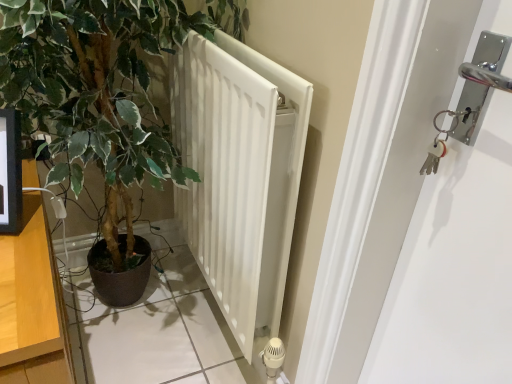
Question: Is green leafy plant at center in front of or behind white matte radiator at center in the image?

Choices:
 (A) behind
 (B) front

Answer: (B)

Question: In terms of width, does green leafy plant at center look wider or thinner when compared to white matte radiator at center?

Choices:
 (A) thin
 (B) wide

Answer: (B)

Question: Which is nearer to the green leafy plant at center?

Choices:
 (A) white matte radiator at center
 (B) wooden dresser at left

Answer: (A)

Question: Based on their relative distances, which object is farther from the green leafy plant at center?

Choices:
 (A) white matte radiator at center
 (B) wooden dresser at left

Answer: (B)